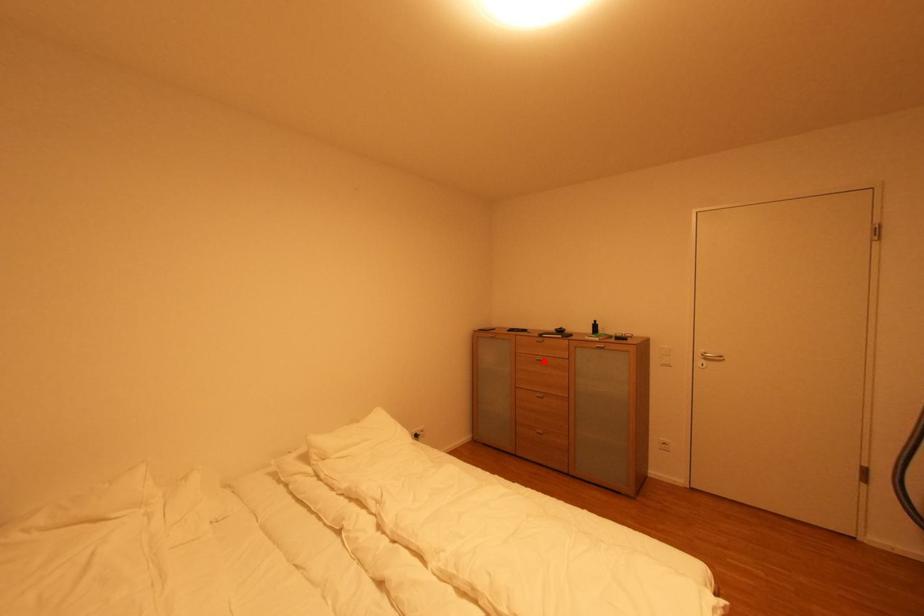
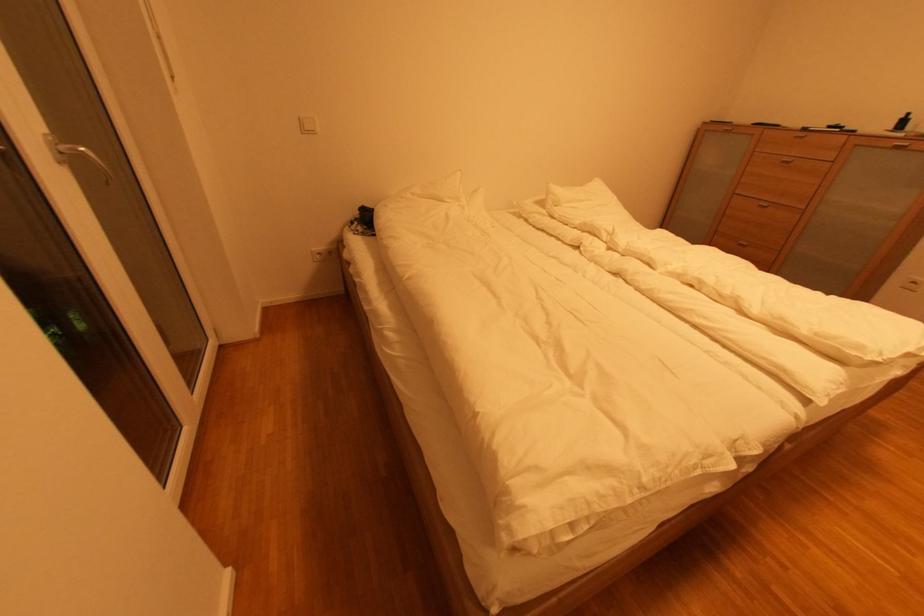
Locate, in the second image, the point that corresponds to the highlighted location in the first image.

(789, 163)